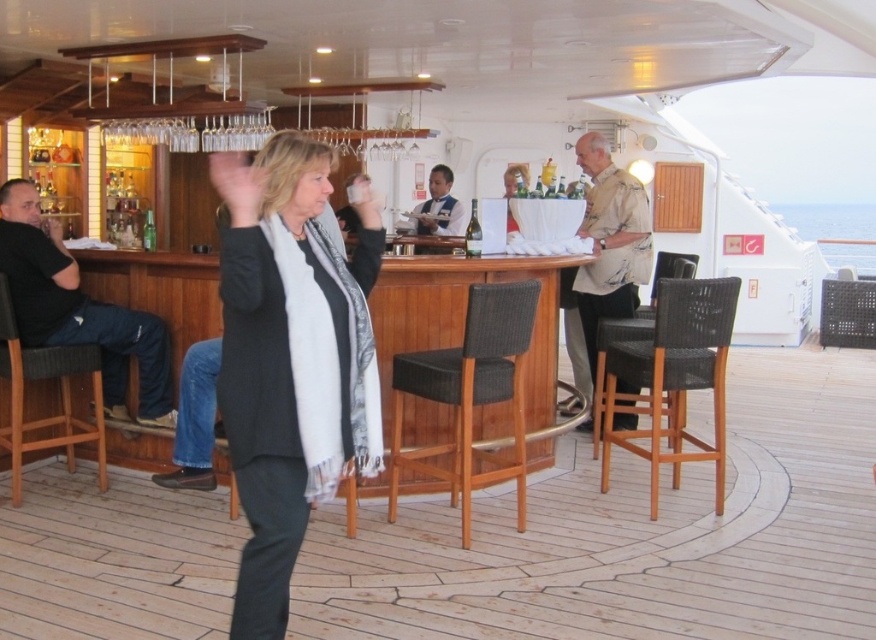
Can you confirm if black cotton shirt at left is wider than green glass bottle at center?

Indeed, black cotton shirt at left has a greater width compared to green glass bottle at center.

At what (x,y) coordinates should I click in order to perform the action: click on black cotton shirt at left. Please return your answer as a coordinate pair (x, y). Looking at the image, I should click on (79, 308).

Find the location of a particular element. The width and height of the screenshot is (876, 640). black cotton shirt at left is located at coordinates (79, 308).

Who is more distant from viewer, (714,385) or (475,209)?

The point (475,209) is more distant.

Can you confirm if woven wood bar stool at center is positioned to the right of green glass bottle at center?

Indeed, woven wood bar stool at center is positioned on the right side of green glass bottle at center.

Describe the element at coordinates (675, 378) in the screenshot. I see `woven wood bar stool at center` at that location.

This screenshot has width=876, height=640. I want to click on woven wood bar stool at center, so click(x=675, y=378).

Does beige textured shirt at center have a lesser height compared to dark blue uniform at center?

In fact, beige textured shirt at center may be taller than dark blue uniform at center.

This screenshot has height=640, width=876. I want to click on beige textured shirt at center, so click(x=610, y=241).